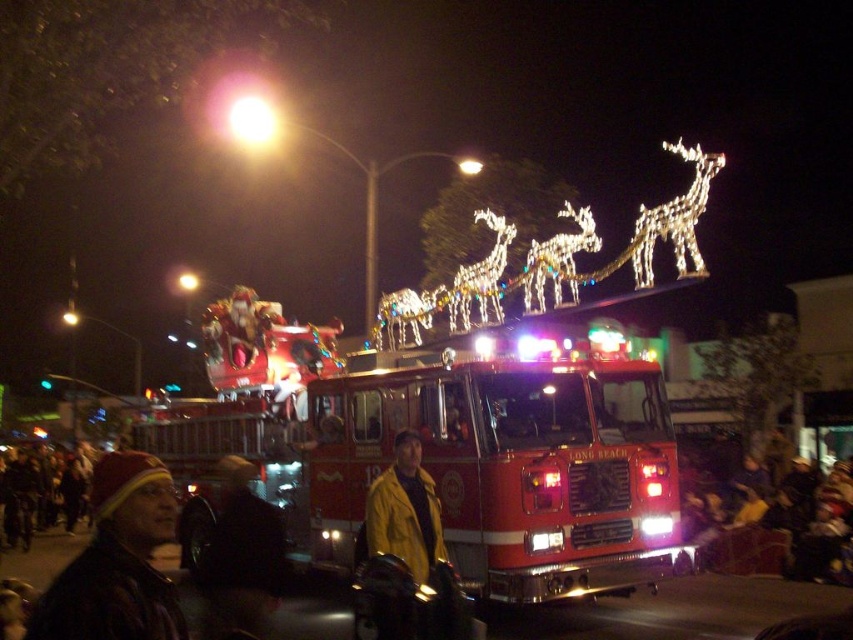
You are standing at a parade watching the shiny red fire truck at center. You want to take a photo of it with your camera. The camera requires you to be at least 50 meters away to capture the entire vehicle in one frame. Can you do it?

The shiny red fire truck at center and the camera are 50.13 meters apart, which is just over the required 50 meters. Therefore, you can capture the entire vehicle in one frame.